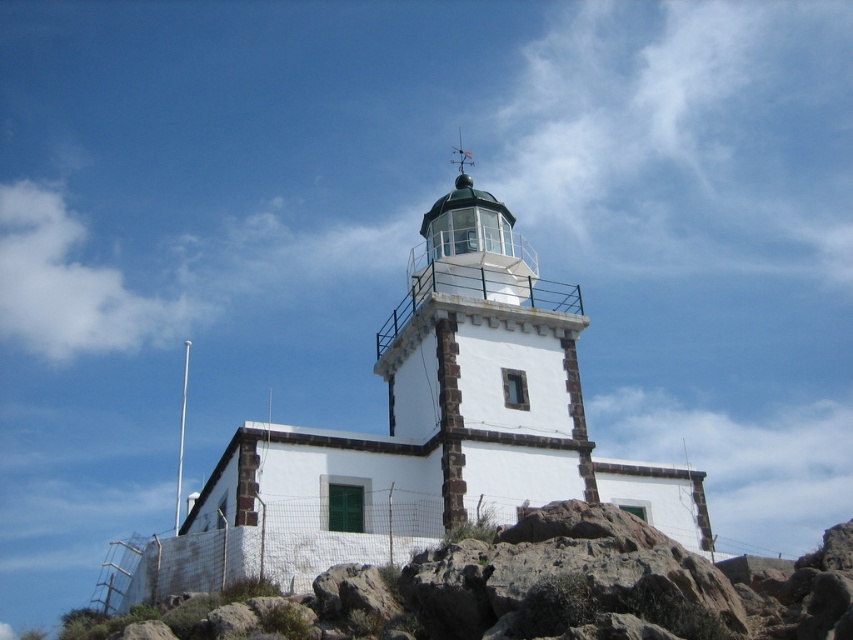
You are a hiker who wants to take a photo of the white stone lighthouse at center. You are currently standing on the rocky terrain at lower right. Which direction should you move to get a better view of the lighthouse?

Since the rocky terrain at lower right is smaller than the white stone lighthouse at center, you should move to a higher ground or position yourself further back to ensure the lighthouse is fully visible in your photo.

In the scene shown: You are standing in front of the lighthouse and notice two points marked on the image. The first point is at coordinates point (473, 596) and the second is at point (486, 342). Which of these two points is closer to you?

Point (473, 596) is closer to the camera than point (486, 342), so the first point is closer to you.

You are standing at the rocky terrain at lower right and want to reach the white stone lighthouse at center. Which direction should you move to get there?

Since the rocky terrain at lower right is to the left of the white stone lighthouse at center, you should move to the right to reach the lighthouse.